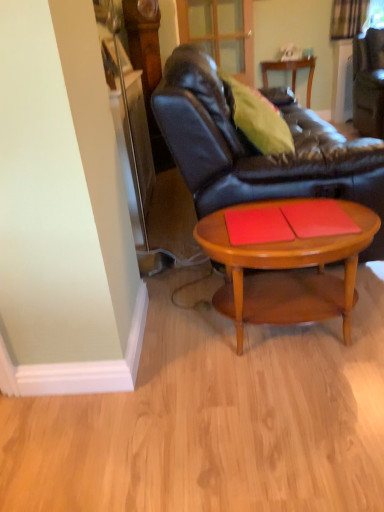
In order to click on vacant area that is in front of light brown wood coffee table at center in this screenshot , I will do `click(284, 419)`.